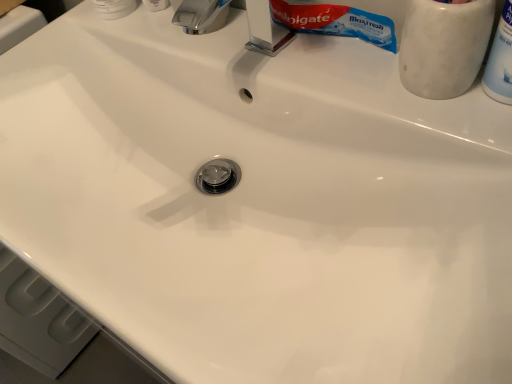
Find the location of a particular element. vacant space situated on the left part of white plastic bottle at upper right, which is counted as the first toiletry, starting from the right is located at coordinates (377, 105).